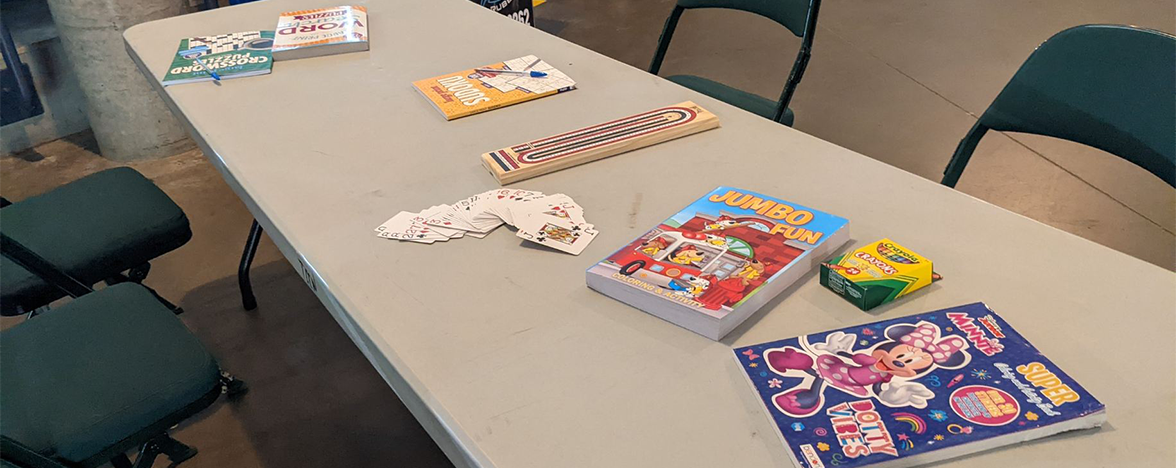
This screenshot has width=1176, height=468. I want to click on table, so click(481, 399).